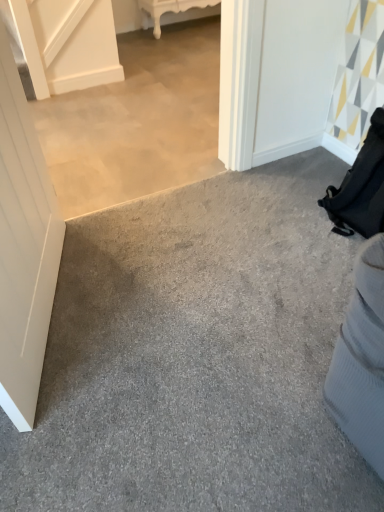
Question: Is the depth of gray carpet at lower right greater than that of white glossy table at upper center?

Choices:
 (A) no
 (B) yes

Answer: (A)

Question: Is white glossy table at upper center completely or partially inside gray carpet at lower right?

Choices:
 (A) no
 (B) yes

Answer: (A)

Question: From a real-world perspective, is gray carpet at lower right physically above white glossy table at upper center?

Choices:
 (A) yes
 (B) no

Answer: (B)

Question: Is gray carpet at lower right bigger than white glossy table at upper center?

Choices:
 (A) no
 (B) yes

Answer: (B)

Question: Can you confirm if gray carpet at lower right is wider than white glossy table at upper center?

Choices:
 (A) yes
 (B) no

Answer: (A)

Question: Is point (26, 233) closer or farther from the camera than point (82, 224)?

Choices:
 (A) farther
 (B) closer

Answer: (B)

Question: From a real-world perspective, is white matte door at left above or below gray carpet at lower right?

Choices:
 (A) above
 (B) below

Answer: (A)

Question: Which is correct: white matte door at left is inside gray carpet at lower right, or outside of it?

Choices:
 (A) outside
 (B) inside

Answer: (A)

Question: From the image's perspective, relative to gray carpet at lower right, is white matte door at left above or below?

Choices:
 (A) above
 (B) below

Answer: (A)

Question: Does point (147, 19) appear closer or farther from the camera than point (41, 251)?

Choices:
 (A) closer
 (B) farther

Answer: (B)

Question: Is white glossy table at upper center in front of or behind white matte door at left in the image?

Choices:
 (A) front
 (B) behind

Answer: (B)

Question: Is white glossy table at upper center to the left or to the right of white matte door at left in the image?

Choices:
 (A) right
 (B) left

Answer: (A)

Question: Choose the correct answer: Is white glossy table at upper center inside white matte door at left or outside it?

Choices:
 (A) inside
 (B) outside

Answer: (B)

Question: From the image's perspective, relative to white glossy table at upper center, is gray carpet at lower right above or below?

Choices:
 (A) above
 (B) below

Answer: (B)

Question: Based on their sizes in the image, would you say gray carpet at lower right is bigger or smaller than white glossy table at upper center?

Choices:
 (A) small
 (B) big

Answer: (B)